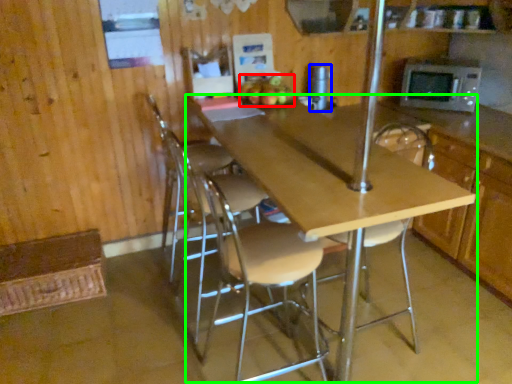
Question: Considering the real-world distances, which object is farthest from apple (highlighted by a red box)? appliance (highlighted by a blue box) or table (highlighted by a green box)?

Choices:
 (A) appliance
 (B) table

Answer: (B)